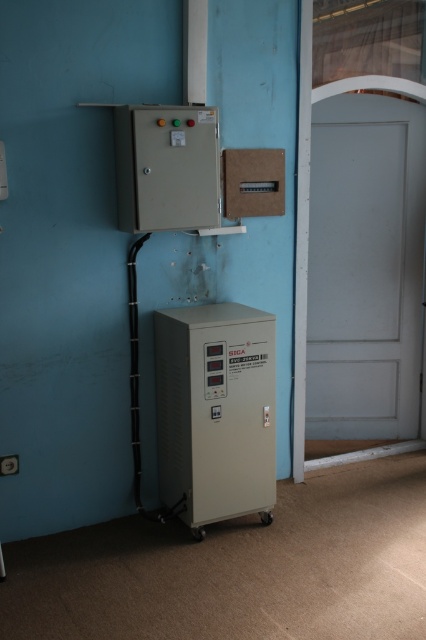
You are standing in front of the electrical setup on the light blue wall. You need to locate two specific points marked in the image. The first point is at coordinates point (255, 353) and the second is at point (149, 109). From your current position, which point is closer to you?

Point (149, 109) is closer to you because point (255, 353) is behind it according to the spatial arrangement.

You are a technician needing to access both the white matte door at right and the gray matte power supply at center. Which one do you need to reach first to access the one further away?

You need to first reach the white matte door at right because it is closer to you than the gray matte power supply at center, which is further away. Once you move past the door, you can then access the power supply behind it.